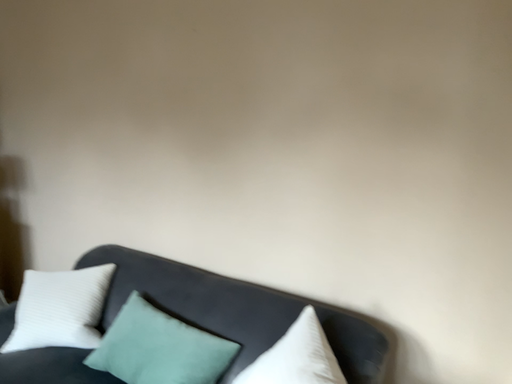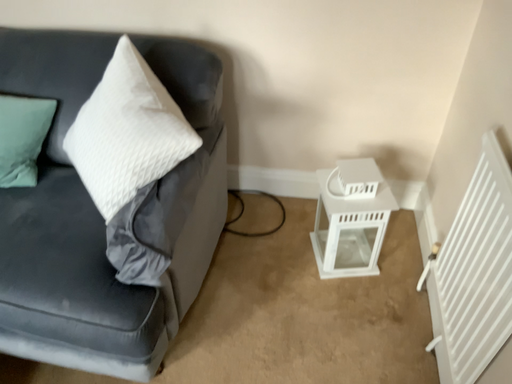
Question: Which way did the camera rotate in the video?

Choices:
 (A) rotated upward
 (B) rotated downward

Answer: (B)